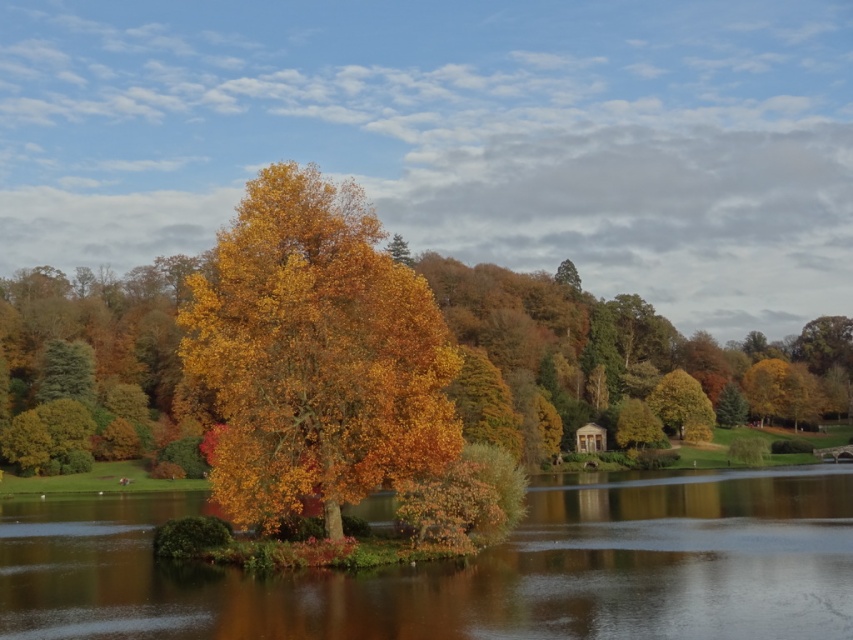
Question: Does transparent water at center have a greater width compared to golden matte tree at center?

Choices:
 (A) yes
 (B) no

Answer: (A)

Question: Which is farther from the transparent water at center?

Choices:
 (A) golden matte tree at center
 (B) green matte tree at upper right

Answer: (B)

Question: Where is golden matte tree at center located in relation to green matte tree at upper right in the image?

Choices:
 (A) right
 (B) left

Answer: (B)

Question: Is transparent water at center thinner than green matte tree at upper right?

Choices:
 (A) yes
 (B) no

Answer: (B)

Question: Which object appears farthest from the camera in this image?

Choices:
 (A) green matte tree at upper right
 (B) transparent water at center
 (C) golden matte tree at center

Answer: (A)

Question: Which point is farther to the camera?

Choices:
 (A) coord(341,488)
 (B) coord(695,408)
 (C) coord(764,528)

Answer: (B)